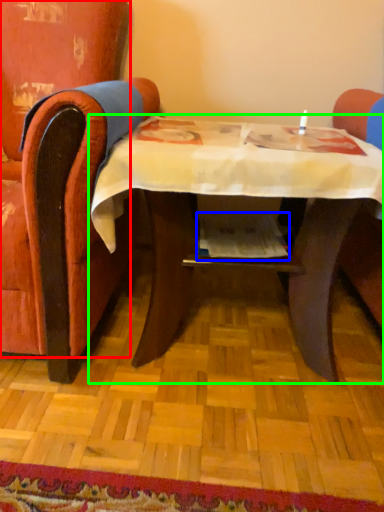
Question: Estimate the real-world distances between objects in this image. Which object is farther from chair (highlighted by a red box), magazine (highlighted by a blue box) or table (highlighted by a green box)?

Choices:
 (A) magazine
 (B) table

Answer: (A)